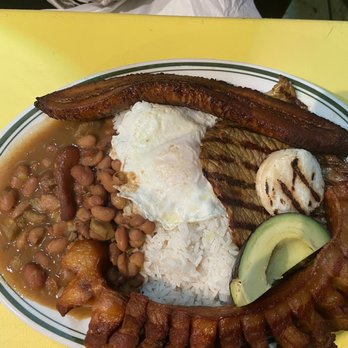
Identify the location of yellow table. (68, 46).